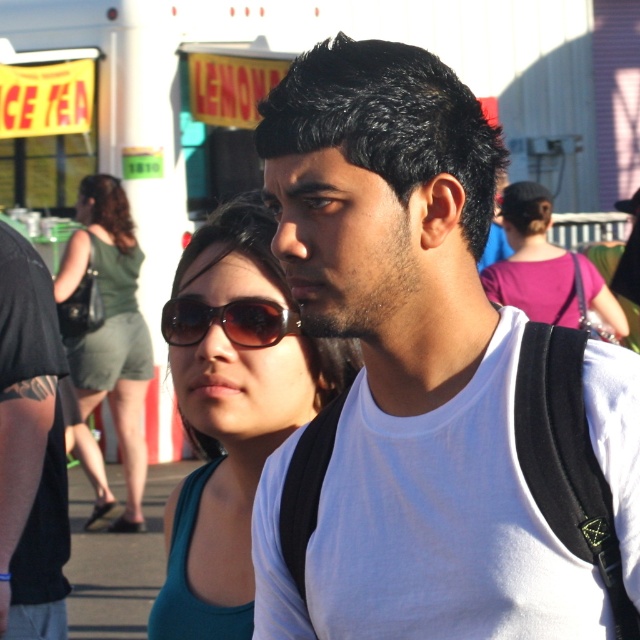
Is green fabric dress at left smaller than purple fabric shirt at upper right?

Incorrect, green fabric dress at left is not smaller in size than purple fabric shirt at upper right.

Does point (102, 374) come closer to viewer compared to point (572, 296)?

No, it is behind (572, 296).

At what (x,y) coordinates should I click in order to perform the action: click on green fabric dress at left. Please return your answer as a coordinate pair (x, y). Looking at the image, I should click on (109, 328).

Looking at this image, measure the distance from white matte tank top at center to teal fabric sunglasses at center.

38.79 inches

Can you confirm if white matte tank top at center is bigger than teal fabric sunglasses at center?

Indeed, white matte tank top at center has a larger size compared to teal fabric sunglasses at center.

Identify the location of white matte tank top at center. The width and height of the screenshot is (640, 640). click(x=429, y=385).

The image size is (640, 640). I want to click on white matte tank top at center, so click(x=429, y=385).

Who is positioned more to the left, teal fabric sunglasses at center or brown reflective sunglasses at center?

Positioned to the left is teal fabric sunglasses at center.

What do you see at coordinates (232, 412) in the screenshot?
I see `teal fabric sunglasses at center` at bounding box center [232, 412].

Locate an element on the screen. teal fabric sunglasses at center is located at coordinates (232, 412).